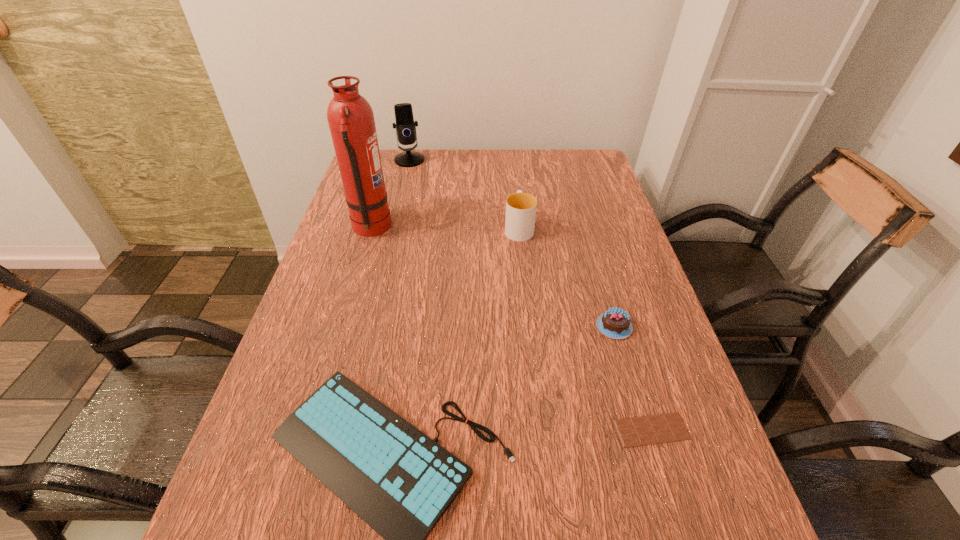
Find the location of `the tallest object`. the tallest object is located at coordinates (350, 117).

Find the location of a particular element. microphone is located at coordinates (405, 125).

Identify the location of the fifth shortest object. The height and width of the screenshot is (540, 960). (405, 125).

Locate an element on the screen. The width and height of the screenshot is (960, 540). cup is located at coordinates (521, 207).

At what (x,y) coordinates should I click in order to perform the action: click on the third object from right to left. Please return your answer as a coordinate pair (x, y). The width and height of the screenshot is (960, 540). Looking at the image, I should click on (521, 207).

The width and height of the screenshot is (960, 540). I want to click on the fourth farthest object, so click(615, 323).

Find the location of `the third shortest object`. the third shortest object is located at coordinates (615, 323).

Find the location of a particular element. This screenshot has height=540, width=960. chocolate bar is located at coordinates (662, 428).

Find the location of a particular element. vacant space located 0.270m on the label side of the tallest object is located at coordinates (486, 228).

Identify the location of free space located 0.140m on the stand of the microphone. (402, 190).